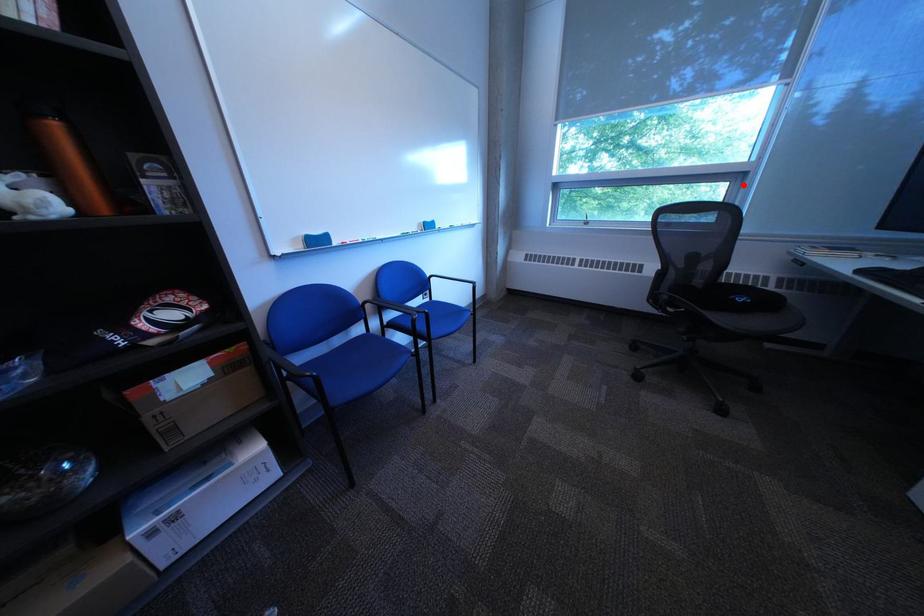
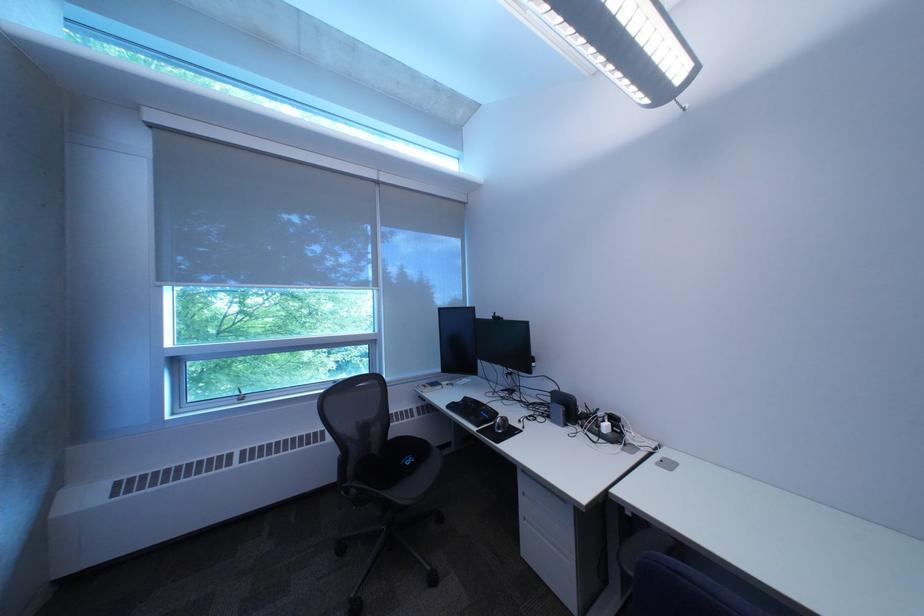
Locate, in the second image, the point that corresponds to the highlighted location in the first image.

(383, 347)